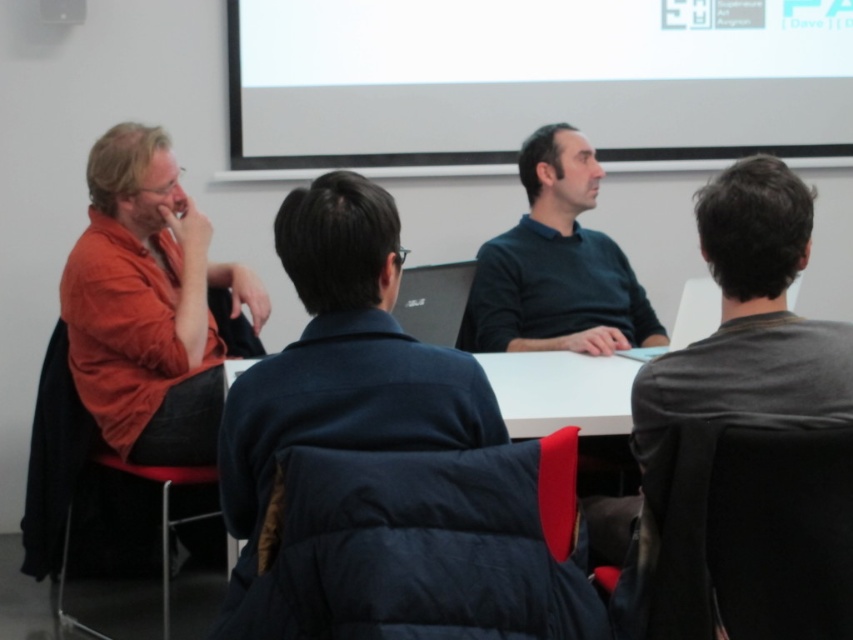
You are standing in the conference room and see the point marked at coordinates [323,268]. If you want to place a small plant exactly 5 feet away from that point, where should you place it relative to the table?

The point at [323,268] is 4.69 feet away from the viewer. To place a small plant exactly 5 feet away from that point, you would need to position it slightly further away from the viewer than the current point, maintaining the same general direction towards the table.

You are organizing a photo shoot and need to arrange two props next to the dark blue puffer jacket at center and the matte orange shirt at left. Given their sizes, which prop should you place closer to the edge of the table to avoid overcrowding?

Since the dark blue puffer jacket at center occupies less space than the matte orange shirt at left, the prop next to the dark blue puffer jacket at center should be placed closer to the edge of the table to accommodate its smaller size and prevent overcrowding.

From the picture: You are standing in front of the table and want to place a small object on the table. You have two points to choose from. The first point is at coordinate point (x=177, y=172) and the second is at coordinate point (x=575, y=211). Which point is closer to you?

Point (x=177, y=172) is closer to the camera than point (x=575, y=211), so you should choose point (x=177, y=172) as it is closer to you.